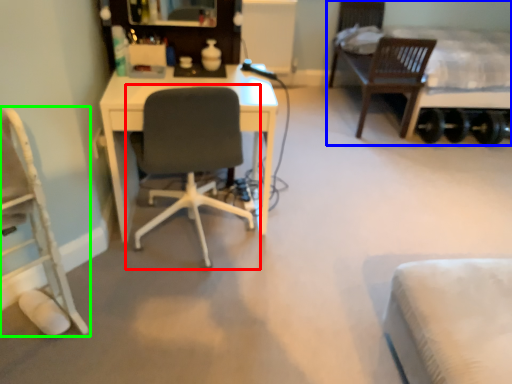
Question: Estimate the real-world distances between objects in this image. Which object is farther from chair (highlighted by a red box), bed (highlighted by a blue box) or chair (highlighted by a green box)?

Choices:
 (A) bed
 (B) chair

Answer: (A)